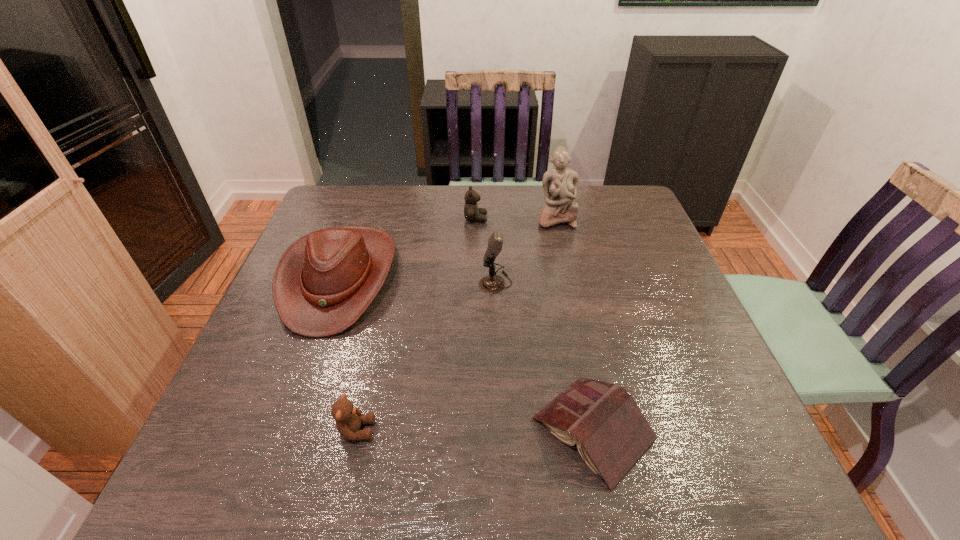
Locate an element on the screen. free space at the far edge is located at coordinates (427, 202).

Find the location of a particular element. Image resolution: width=960 pixels, height=540 pixels. vacant space at the near edge of the desktop is located at coordinates (597, 497).

This screenshot has width=960, height=540. Find the location of `vacant region at the left edge of the desktop`. vacant region at the left edge of the desktop is located at coordinates (259, 329).

Image resolution: width=960 pixels, height=540 pixels. In the image, there is a desktop. Identify the location of vacant space at the right edge. (680, 430).

In the image, there is a desktop. Identify the location of vacant space at the far left corner. This screenshot has width=960, height=540. (334, 191).

You are a GUI agent. You are given a task and a screenshot of the screen. Output one action in this format:
    pyautogui.click(x=<x>, y=<y>)
    Task: Click on the free space between the fifth shortest object and the shortest object
    
    Given the screenshot: What is the action you would take?
    pyautogui.click(x=544, y=356)

Locate an element on the screen. Image resolution: width=960 pixels, height=540 pixels. blank region between the shorter teddy bear and the cowboy hat is located at coordinates (348, 354).

Find the location of a particular element. vacant area that lies between the right teddy bear and the second shortest object is located at coordinates (416, 325).

Find the location of a particular element. The height and width of the screenshot is (540, 960). free spot between the shorter teddy bear and the shortest object is located at coordinates (475, 430).

At what (x,y) coordinates should I click in order to perform the action: click on unoccupied position between the farther teddy bear and the second tallest object. Please return your answer as a coordinate pair (x, y). Looking at the image, I should click on (486, 251).